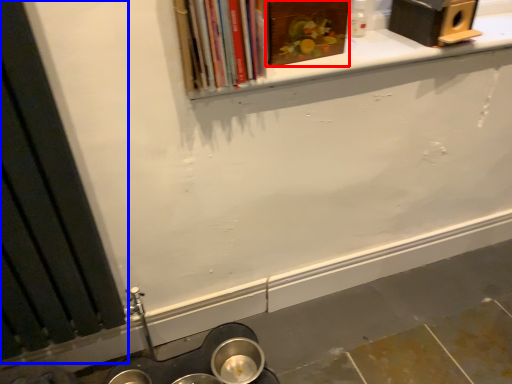
Question: Which point is further to the camera, book (highlighted by a red box) or window frame (highlighted by a blue box)?

Choices:
 (A) book
 (B) window frame

Answer: (A)